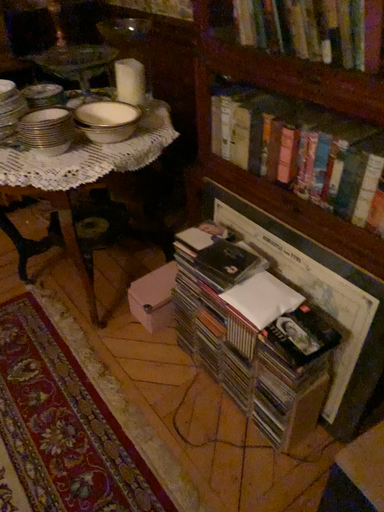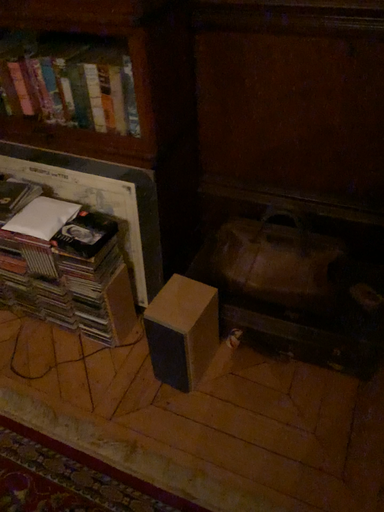
Question: Which way did the camera rotate in the video?

Choices:
 (A) rotated left
 (B) rotated right

Answer: (B)